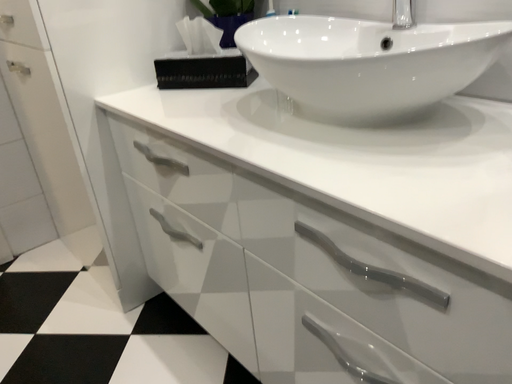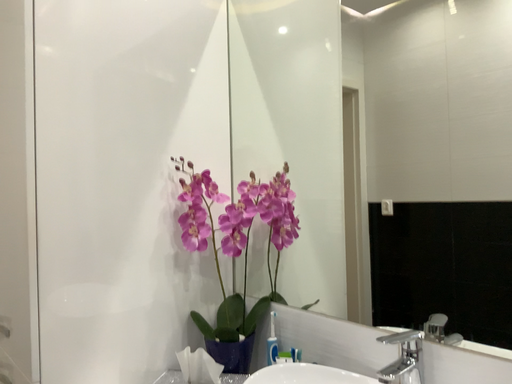
Question: Which way did the camera rotate in the video?

Choices:
 (A) rotated downward
 (B) rotated upward

Answer: (B)